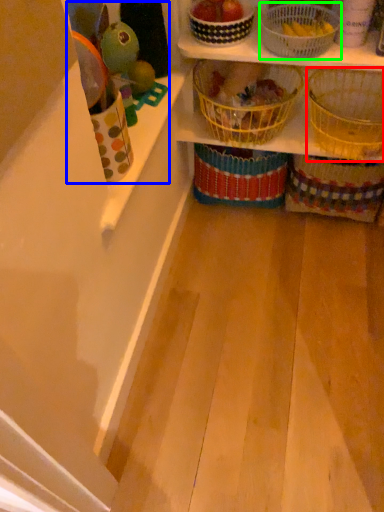
Question: Which is nearer to the basket (highlighted by a red box)? toy (highlighted by a blue box) or basket (highlighted by a green box).

Choices:
 (A) toy
 (B) basket

Answer: (B)